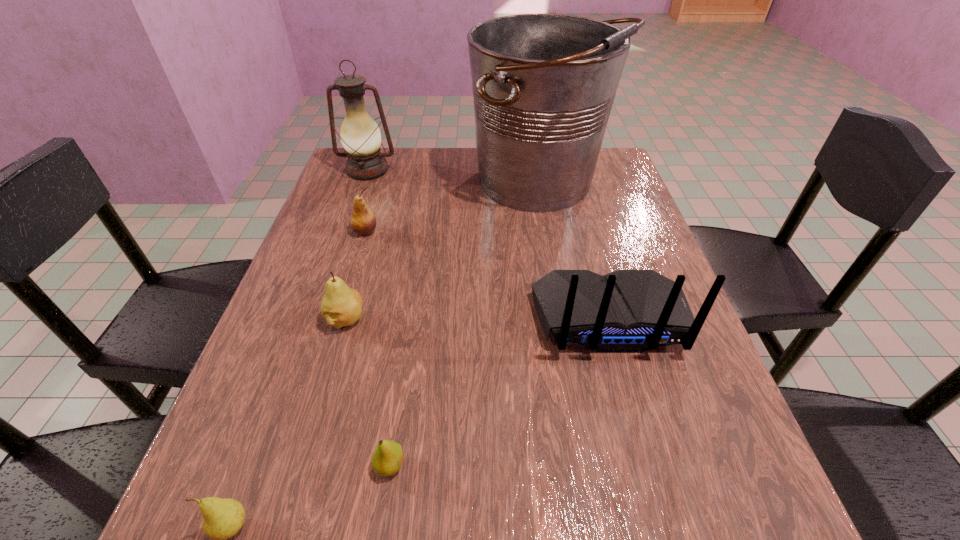
The height and width of the screenshot is (540, 960). What are the coordinates of `the tallest object` in the screenshot? It's located at (543, 85).

Where is `the second tallest object`? Image resolution: width=960 pixels, height=540 pixels. the second tallest object is located at coordinates (360, 136).

I want to click on router, so click(x=626, y=311).

This screenshot has width=960, height=540. What are the coordinates of `the farthest pear` in the screenshot? It's located at (363, 221).

Identify the location of the second farthest pear. This screenshot has width=960, height=540. (341, 306).

In order to click on the second nearest pear in this screenshot , I will do `click(387, 458)`.

Locate an element on the screen. The width and height of the screenshot is (960, 540). the sixth farthest object is located at coordinates (387, 458).

Where is `vacant area situated 0.070m on the left of the tallest object`? The image size is (960, 540). vacant area situated 0.070m on the left of the tallest object is located at coordinates (444, 184).

Where is `vacant space located on the front of the second tallest object`? The image size is (960, 540). vacant space located on the front of the second tallest object is located at coordinates (341, 245).

Identify the location of vacant space located on the back of the third tallest object. click(x=638, y=423).